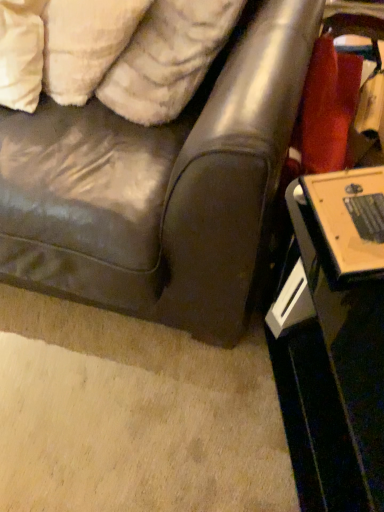
Question: In the image, is white fluffy pillow at upper left, which is the 1th pillow in right-to-left order, on the left side or the right side of leather couch at center?

Choices:
 (A) left
 (B) right

Answer: (B)

Question: From the image's perspective, relative to leather couch at center, is white fluffy pillow at upper left, the second pillow from the left, above or below?

Choices:
 (A) above
 (B) below

Answer: (A)

Question: Considering the real-world distances, which object is closest to the leather couch at center?

Choices:
 (A) white fluffy pillow at upper left, which is the 1th pillow in left-to-right order
 (B) white fluffy pillow at upper left, which is the 1th pillow in right-to-left order
 (C) black glossy table at lower right

Answer: (B)

Question: Which object is the closest to the leather couch at center?

Choices:
 (A) white fluffy pillow at upper left, the second pillow from the left
 (B) black glossy table at lower right
 (C) white fluffy pillow at upper left, which ranks as the 2th pillow in right-to-left order

Answer: (A)